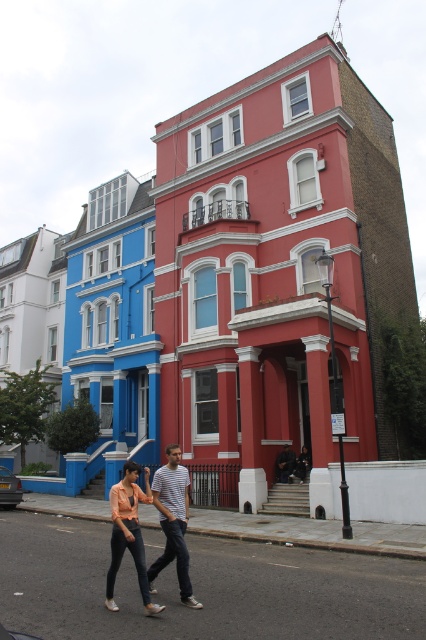
Question: Which point is closer to the camera?

Choices:
 (A) (166, 528)
 (B) (284, 451)

Answer: (A)

Question: Is striped cotton shirt at center further to the viewer compared to matte peach blouse at center?

Choices:
 (A) yes
 (B) no

Answer: (A)

Question: Does matte peach blouse at center have a greater width compared to dark gray fabric jacket at center?

Choices:
 (A) no
 (B) yes

Answer: (B)

Question: Which is nearer to the dark gray fabric jacket at center?

Choices:
 (A) striped cotton shirt at center
 (B) matte peach blouse at center

Answer: (B)

Question: From the image, what is the correct spatial relationship of matte peach blouse at center in relation to dark gray fabric jacket at center?

Choices:
 (A) right
 (B) left

Answer: (B)

Question: Which point is closer to the camera?

Choices:
 (A) (115, 500)
 (B) (279, 458)

Answer: (A)